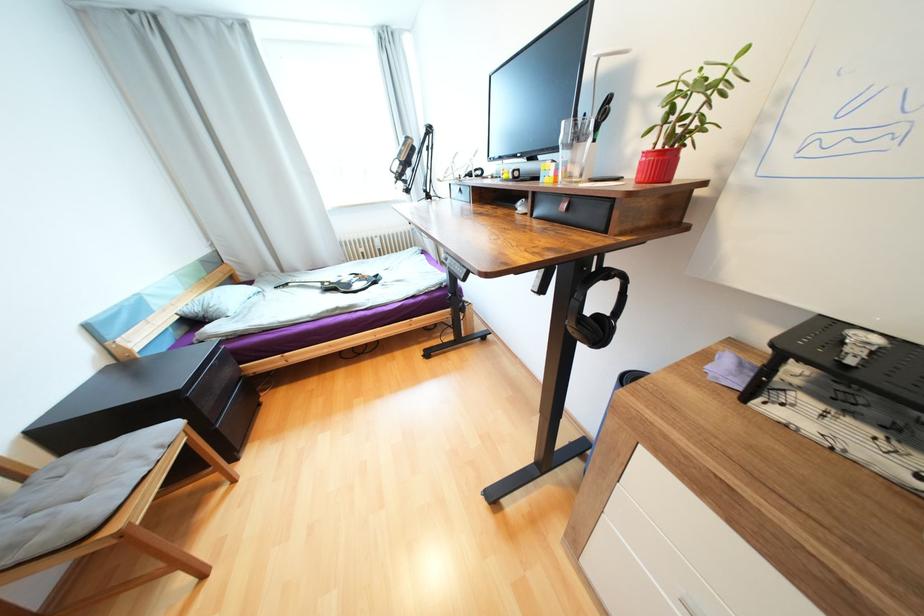
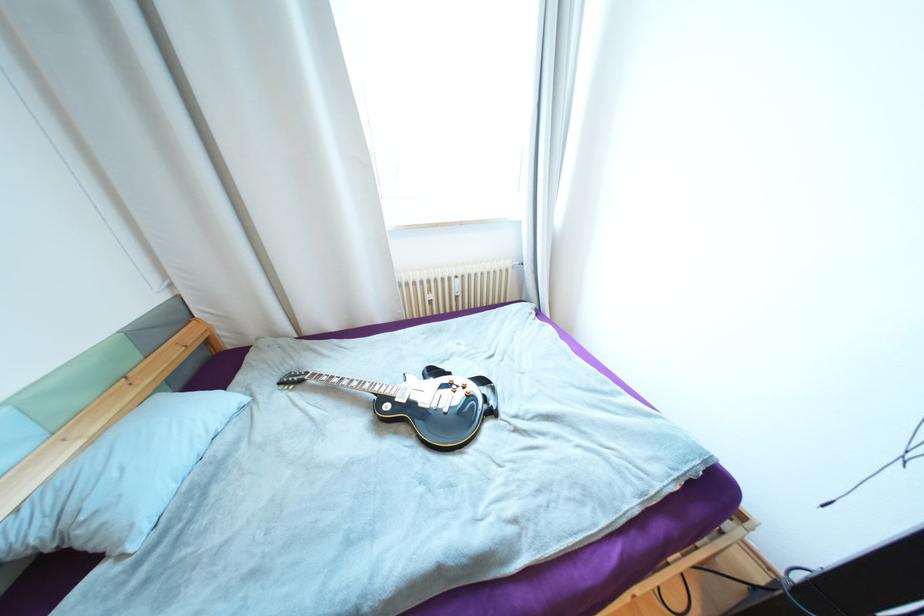
Where in the second image is the point corresponding to the point at 385,251 from the first image?

(463, 297)